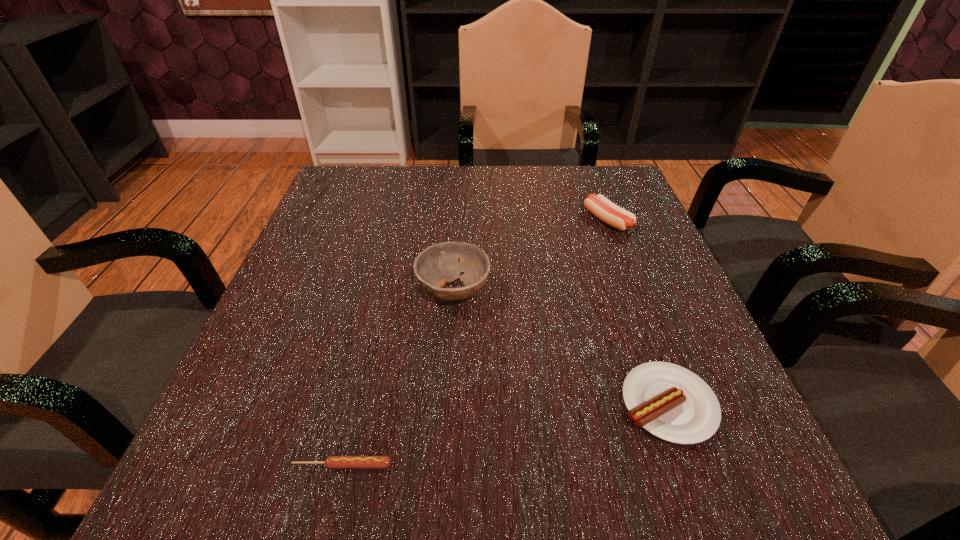
Image resolution: width=960 pixels, height=540 pixels. I want to click on vacant space at the near left corner of the desktop, so click(295, 476).

In the image, there is a desktop. At what (x,y) coordinates should I click in order to perform the action: click on vacant space at the far right corner. Please return your answer as a coordinate pair (x, y). This screenshot has height=540, width=960. Looking at the image, I should click on (578, 198).

In the image, there is a desktop. Where is `vacant space at the near right corner`? vacant space at the near right corner is located at coordinates (684, 502).

Identify the location of vacant point located between the leftmost sausage and the farthest object. (475, 343).

This screenshot has height=540, width=960. I want to click on unoccupied position between the nearest sausage and the farthest sausage, so 475,343.

Find the location of a particular element. The image size is (960, 540). free area in between the tallest object and the second farthest sausage is located at coordinates (561, 348).

What are the coordinates of `vacant area that lies between the nearest object and the third tallest object` in the screenshot? It's located at (505, 435).

The image size is (960, 540). I want to click on vacant space that is in between the second farthest object and the leftmost sausage, so click(x=398, y=378).

Find the location of `blank region between the second shortest object and the farthest object`. blank region between the second shortest object and the farthest object is located at coordinates [637, 313].

Locate an element on the screen. free point between the nearest object and the second nearest sausage is located at coordinates (505, 435).